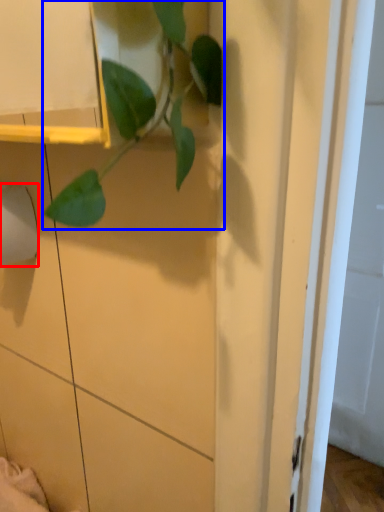
Question: Which object appears farthest to the camera in this image, toilet paper (highlighted by a red box) or houseplant (highlighted by a blue box)?

Choices:
 (A) toilet paper
 (B) houseplant

Answer: (A)